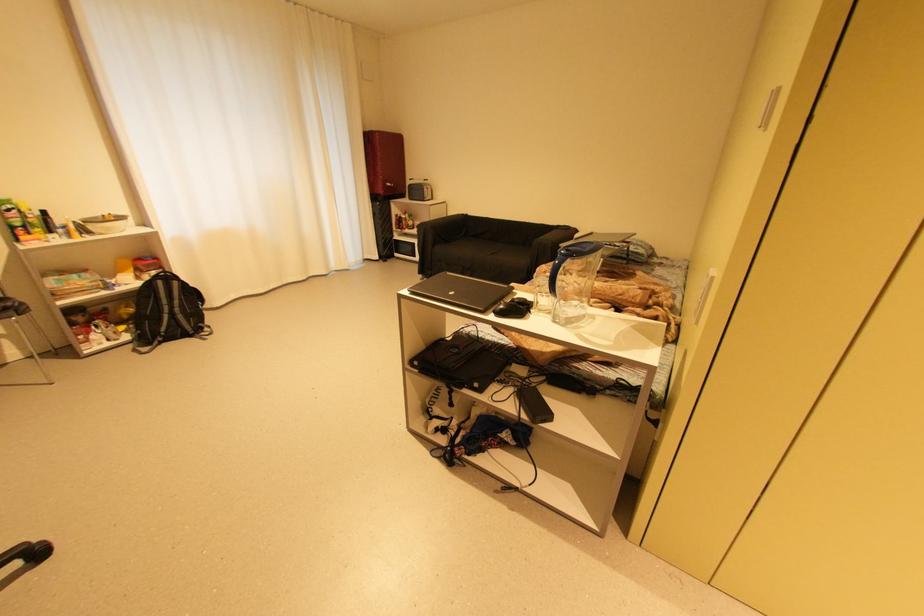
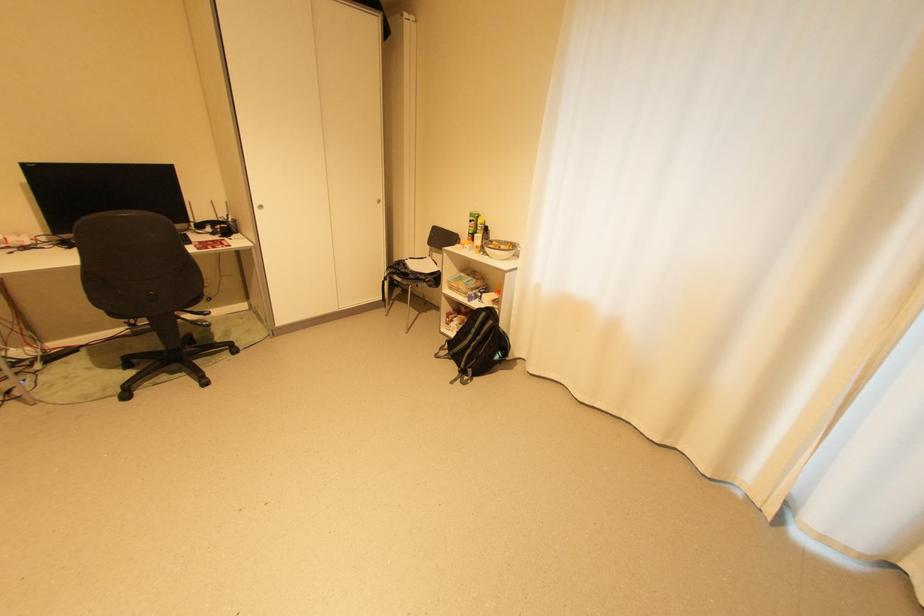
The point at (98, 233) is marked in the first image. Where is the corresponding point in the second image?

(492, 253)